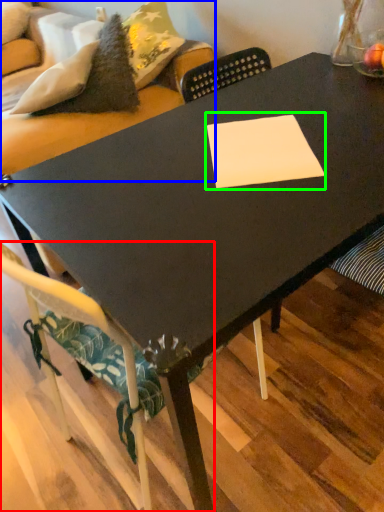
Question: Which object is positioned farthest from chair (highlighted by a red box)? Select from couch (highlighted by a blue box) and rectangle (highlighted by a green box).

Choices:
 (A) couch
 (B) rectangle

Answer: (A)